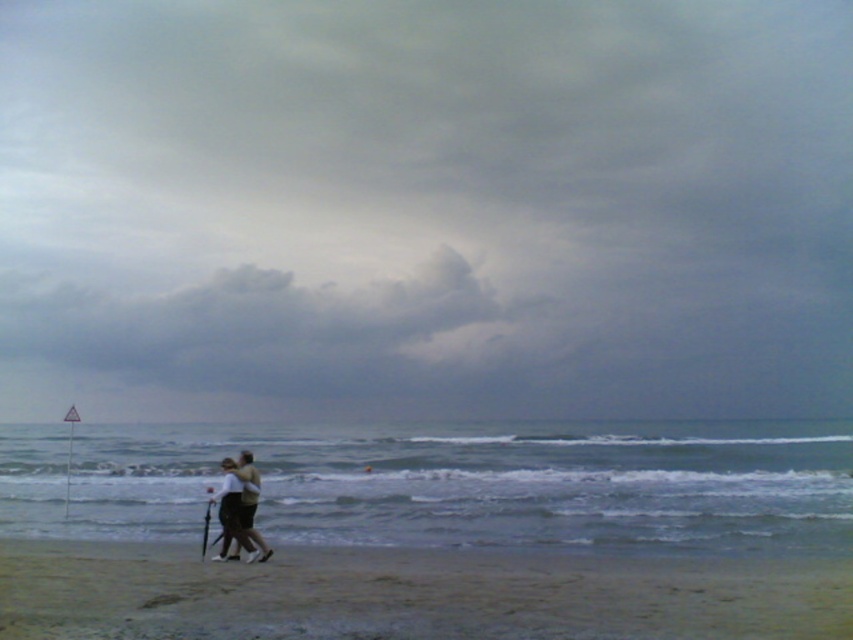
Which is above, gray cloudy sky at upper center or sandy at lower center?

gray cloudy sky at upper center is above.

Can you confirm if gray cloudy sky at upper center is wider than sandy at lower center?

Yes, gray cloudy sky at upper center is wider than sandy at lower center.

Which is behind, point (410, 260) or point (839, 582)?

Point (410, 260)

At what (x,y) coordinates should I click in order to perform the action: click on gray cloudy sky at upper center. Please return your answer as a coordinate pair (x, y). Image resolution: width=853 pixels, height=640 pixels. Looking at the image, I should click on [x=425, y=209].

Does gray cloudy sky at upper center have a lesser width compared to light brown fabric couple at center?

In fact, gray cloudy sky at upper center might be wider than light brown fabric couple at center.

Based on the photo, does gray cloudy sky at upper center have a lesser height compared to light brown fabric couple at center?

In fact, gray cloudy sky at upper center may be taller than light brown fabric couple at center.

At what (x,y) coordinates should I click in order to perform the action: click on gray cloudy sky at upper center. Please return your answer as a coordinate pair (x, y). Image resolution: width=853 pixels, height=640 pixels. Looking at the image, I should click on (425, 209).

What do you see at coordinates (410, 595) in the screenshot?
I see `sandy at lower center` at bounding box center [410, 595].

Between sandy at lower center and light brown fabric couple at center, which one is positioned lower?

Positioned lower is light brown fabric couple at center.

I want to click on sandy at lower center, so click(x=410, y=595).

Where is `sandy at lower center`? sandy at lower center is located at coordinates (410, 595).